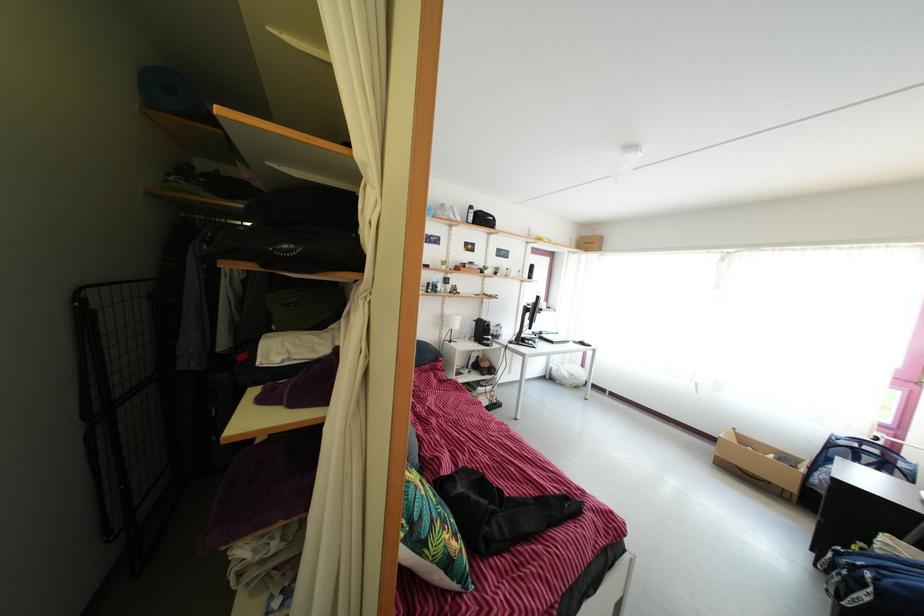
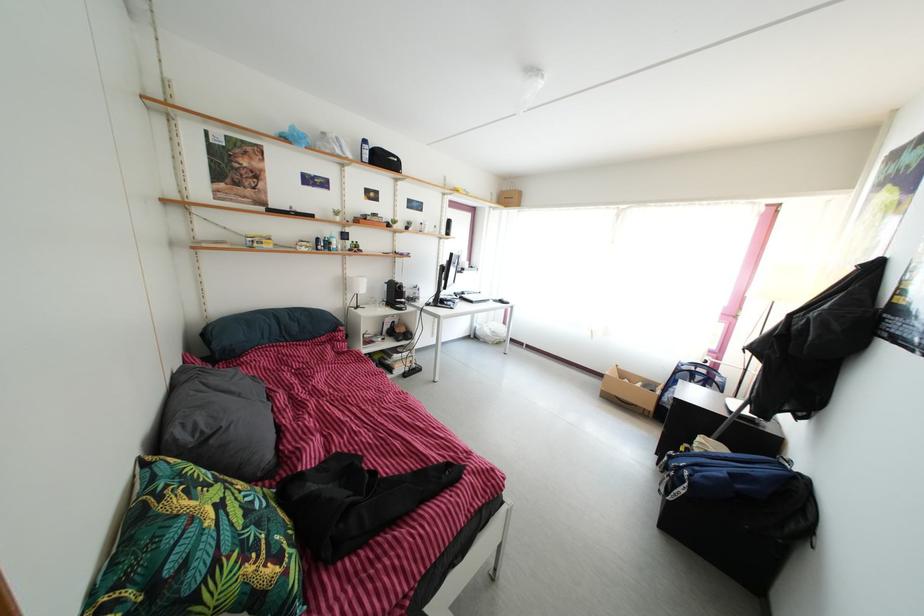
The point at [784,468] is marked in the first image. Where is the corresponding point in the second image?

(650, 394)